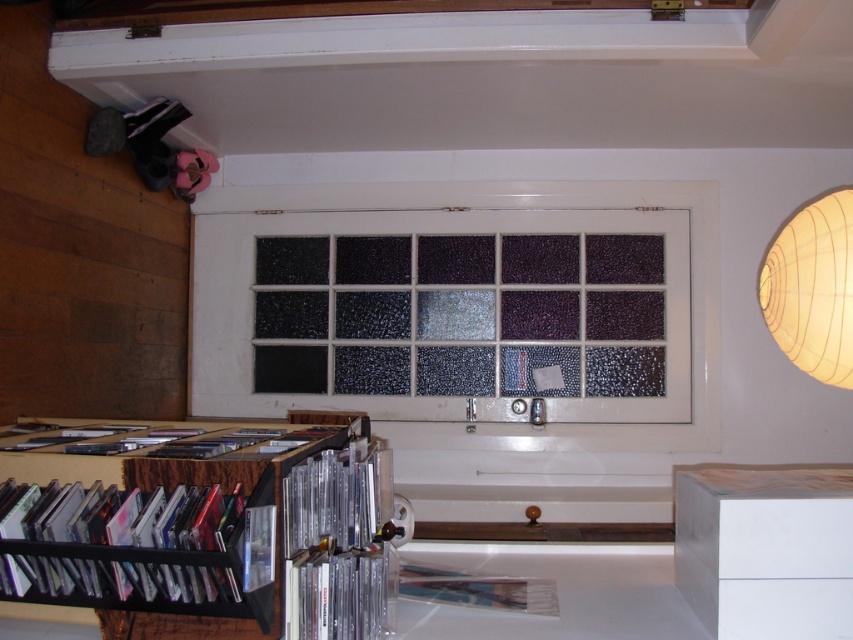
Does point (369, 513) come closer to viewer compared to point (827, 365)?

Yes, point (369, 513) is in front of point (827, 365).

Is clear plastic cd cases at lower left above ivory paper lantern at upper right?

No, clear plastic cd cases at lower left is not above ivory paper lantern at upper right.

Is point (373, 600) closer to camera compared to point (792, 317)?

Yes, it is.

I want to click on clear plastic cd cases at lower left, so click(338, 544).

Is black plastic cd case at lower left to the right of metallic silver book at center from the viewer's perspective?

No, black plastic cd case at lower left is not to the right of metallic silver book at center.

Does black plastic cd case at lower left appear over metallic silver book at center?

Indeed, black plastic cd case at lower left is positioned over metallic silver book at center.

Looking at this image, measure the distance between point [18,486] and camera.

Point [18,486] is 4.84 feet away from camera.

Locate an element on the screen. black plastic cd case at lower left is located at coordinates (132, 564).

Can you confirm if translucent glass window at center is bigger than black plastic cd case at lower left?

Correct, translucent glass window at center is larger in size than black plastic cd case at lower left.

Who is taller, translucent glass window at center or black plastic cd case at lower left?

translucent glass window at center

This screenshot has height=640, width=853. What do you see at coordinates (465, 308) in the screenshot?
I see `translucent glass window at center` at bounding box center [465, 308].

In order to click on translucent glass window at center in this screenshot , I will do `click(465, 308)`.